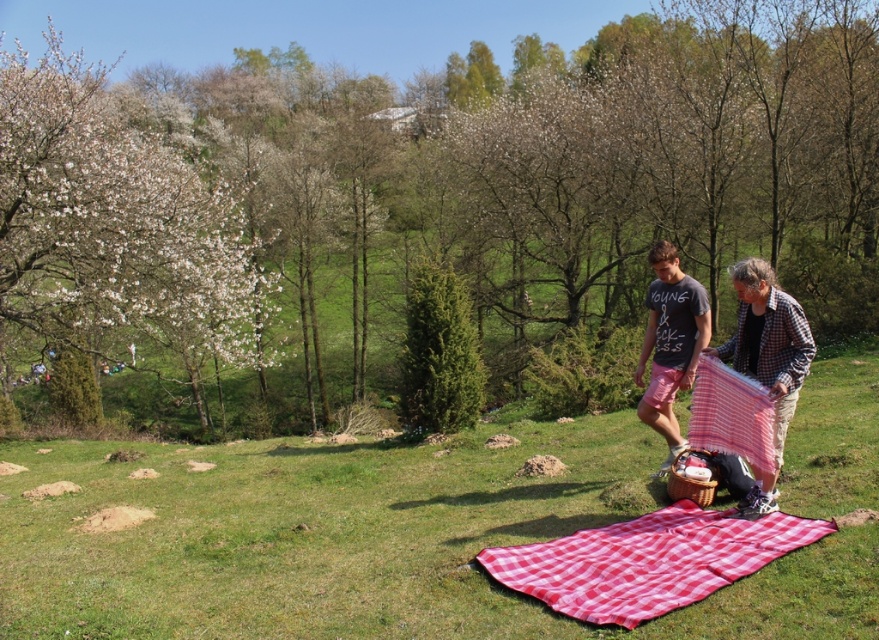
You are planning to set up a picnic and have two options for the picnic blanket. The first is the checkered fabric at center, and the second is the red checkered cloth at lower right. Which one would you choose if you want a larger surface area to spread out your food and items?

The checkered fabric at center might be wider than red checkered cloth at lower right, so it would provide a larger surface area for spreading out food and items.

You are planning to set up a tent in the park and need to choose between the area near the green leafy tree at center or the red checkered cloth at lower right. Based on their positions, which location would be closer to the tree?

The green leafy tree at center is to the left of the red checkered cloth at lower right, so the area near the green leafy tree at center is closer to the tree itself.

You are planning to take a photo of the picnic scene. The photographer wants to ensure the white blossoming tree at left and the red checkered picnic blanket at center are both in frame. Considering their sizes, which object should be placed closer to the camera to maintain balance in the composition?

The white blossoming tree at left is wider than the red checkered picnic blanket at center. To balance the composition, place the smaller red checkered picnic blanket at center closer to the camera so that its size in the frame matches the tree.